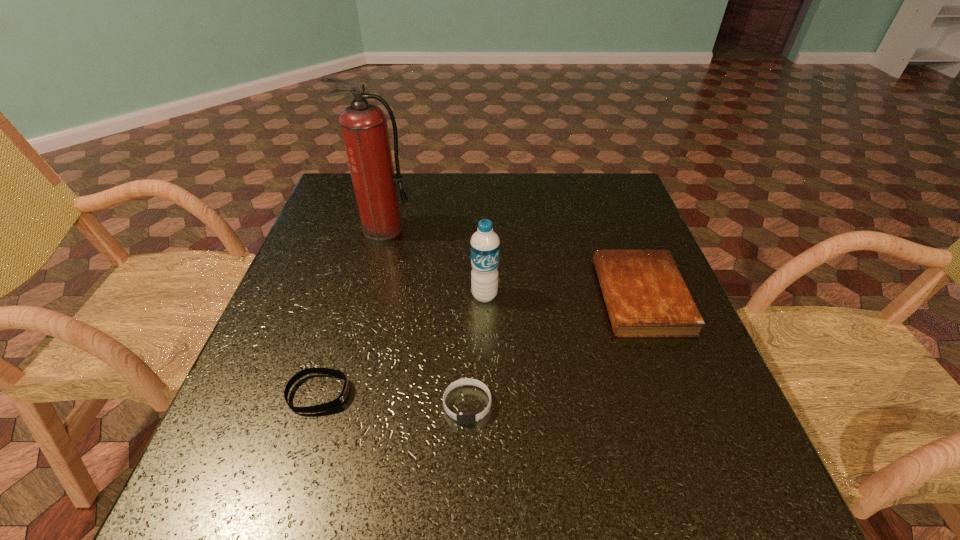
The image size is (960, 540). In order to click on vacant region located 0.290m on the label of the fourth shortest object in this screenshot , I will do `click(486, 426)`.

At what (x,y) coordinates should I click in order to perform the action: click on free space located on the spine side of the rightmost object. Please return your answer as a coordinate pair (x, y). The width and height of the screenshot is (960, 540). Looking at the image, I should click on (531, 297).

You are a GUI agent. You are given a task and a screenshot of the screen. Output one action in this format:
    pyautogui.click(x=<x>, y=<y>)
    Task: Click on the blank space located on the spine side of the rightmost object
    This screenshot has height=540, width=960.
    Given the screenshot: What is the action you would take?
    pyautogui.click(x=473, y=297)

Locate an element on the screen. Image resolution: width=960 pixels, height=540 pixels. vacant space located on the spine side of the rightmost object is located at coordinates tap(575, 297).

You are a GUI agent. You are given a task and a screenshot of the screen. Output one action in this format:
    pyautogui.click(x=<x>, y=<y>)
    Task: Click on the free region located on the outer surface of the right wristband
    The height and width of the screenshot is (540, 960).
    Given the screenshot: What is the action you would take?
    pyautogui.click(x=466, y=470)

This screenshot has height=540, width=960. I want to click on free space located 0.070m on the display of the shortest object, so click(x=387, y=394).

The height and width of the screenshot is (540, 960). In order to click on fire extinguisher at the left edge in this screenshot , I will do `click(364, 128)`.

This screenshot has height=540, width=960. What are the coordinates of `wristband that is at the left edge` in the screenshot? It's located at (336, 403).

Where is `object that is at the right edge`? object that is at the right edge is located at coordinates (645, 295).

Where is `free space at the far edge`? Image resolution: width=960 pixels, height=540 pixels. free space at the far edge is located at coordinates (481, 199).